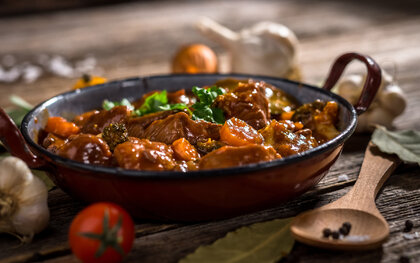
I want to click on skillet handle on left, so click(8, 127).